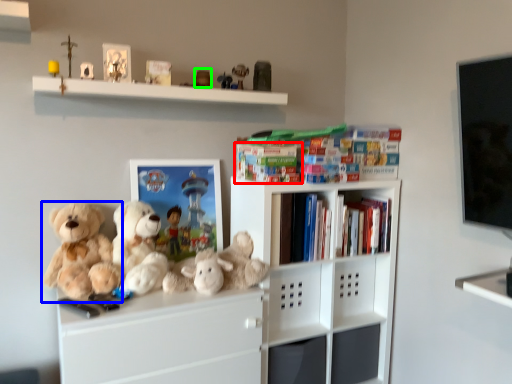
Question: Which object is positioned closest to book (highlighted by a red box)? Select from teddy bear (highlighted by a blue box) and toy (highlighted by a green box).

Choices:
 (A) teddy bear
 (B) toy

Answer: (B)